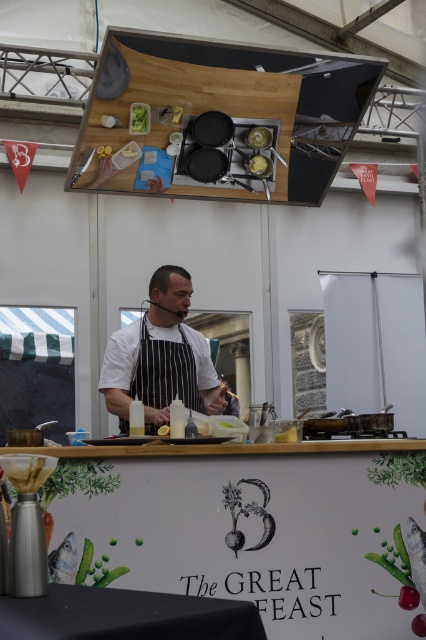
Question: Among these objects, which one is farthest from the camera?

Choices:
 (A) yellow matte cheese at upper center
 (B) white striped apron at center
 (C) yellow matte lemon at center
 (D) green leafy vegetable at upper center

Answer: (A)

Question: Observing the image, what is the correct spatial positioning of white striped apron at center in reference to green leafy vegetable at upper center?

Choices:
 (A) left
 (B) right

Answer: (B)

Question: Based on their relative distances, which object is nearer to the yellow matte lemon at center?

Choices:
 (A) white striped apron at center
 (B) green leafy vegetable at upper center
 (C) yellow matte cheese at upper center

Answer: (A)

Question: Can you confirm if white striped apron at center is positioned to the left of yellow matte cheese at upper center?

Choices:
 (A) no
 (B) yes

Answer: (B)

Question: Which object appears farthest from the camera in this image?

Choices:
 (A) yellow matte lemon at center
 (B) green leafy vegetable at upper center
 (C) white striped apron at center
 (D) yellow matte cheese at upper center

Answer: (D)

Question: Does yellow matte cheese at upper center have a lesser width compared to yellow matte lemon at center?

Choices:
 (A) yes
 (B) no

Answer: (B)